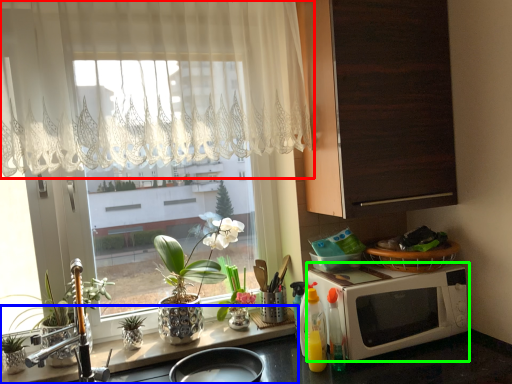
Question: Which object is positioned closest to curtain (highlighted by a red box)? Select from counter top (highlighted by a blue box) and microwave oven (highlighted by a green box).

Choices:
 (A) counter top
 (B) microwave oven

Answer: (B)